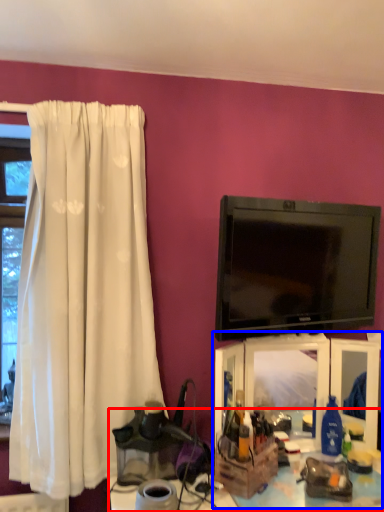
Question: Among these objects, which one is nearest to the camera, table (highlighted by a red box) or entertainment center (highlighted by a blue box)?

Choices:
 (A) table
 (B) entertainment center

Answer: (A)